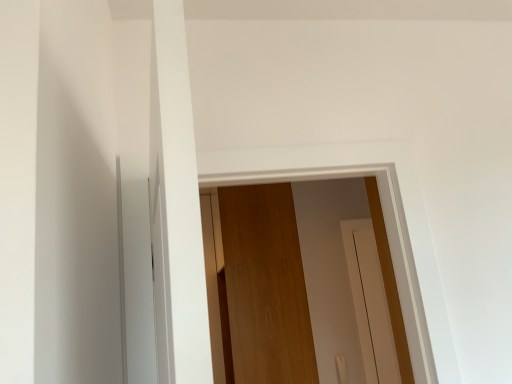
Question: Is wooden screen door at center wider or thinner than wooden door at center?

Choices:
 (A) wide
 (B) thin

Answer: (B)

Question: In the image, is wooden screen door at center on the left side or the right side of wooden door at center?

Choices:
 (A) right
 (B) left

Answer: (A)

Question: In the image, is wooden screen door at center positioned in front of or behind wooden door at center?

Choices:
 (A) front
 (B) behind

Answer: (B)

Question: In terms of height, does wooden door at center look taller or shorter compared to wooden screen door at center?

Choices:
 (A) short
 (B) tall

Answer: (B)

Question: Considering the positions of wooden door at center and wooden screen door at center in the image, is wooden door at center wider or thinner than wooden screen door at center?

Choices:
 (A) thin
 (B) wide

Answer: (B)

Question: Do you think wooden door at center is within wooden screen door at center, or outside of it?

Choices:
 (A) inside
 (B) outside

Answer: (B)

Question: From a real-world perspective, is wooden door at center above or below wooden screen door at center?

Choices:
 (A) below
 (B) above

Answer: (B)